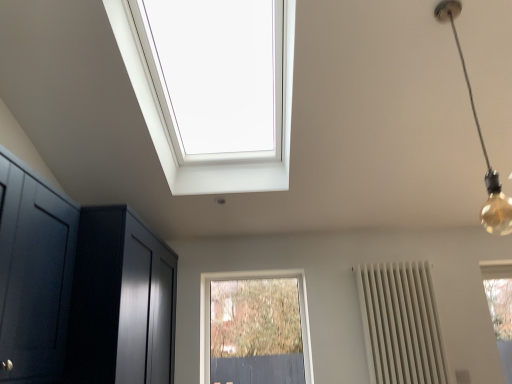
Question: Is glossy dark wood dresser at left beside gold bulb at upper right?

Choices:
 (A) yes
 (B) no

Answer: (B)

Question: Considering the relative sizes of glossy dark wood dresser at left and gold bulb at upper right in the image provided, is glossy dark wood dresser at left thinner than gold bulb at upper right?

Choices:
 (A) yes
 (B) no

Answer: (B)

Question: Can you confirm if glossy dark wood dresser at left is positioned to the right of gold bulb at upper right?

Choices:
 (A) no
 (B) yes

Answer: (A)

Question: Can you confirm if glossy dark wood dresser at left is positioned to the left of gold bulb at upper right?

Choices:
 (A) yes
 (B) no

Answer: (A)

Question: Is the position of glossy dark wood dresser at left more distant than that of gold bulb at upper right?

Choices:
 (A) no
 (B) yes

Answer: (B)

Question: Does glossy dark wood dresser at left have a greater height compared to gold bulb at upper right?

Choices:
 (A) no
 (B) yes

Answer: (A)

Question: From a real-world perspective, is gold bulb at upper right below white matte radiator at right?

Choices:
 (A) yes
 (B) no

Answer: (B)

Question: Is gold bulb at upper right positioned far away from white matte radiator at right?

Choices:
 (A) no
 (B) yes

Answer: (A)

Question: Would you say gold bulb at upper right is outside white matte radiator at right?

Choices:
 (A) no
 (B) yes

Answer: (B)

Question: From a real-world perspective, is gold bulb at upper right positioned over white matte radiator at right based on gravity?

Choices:
 (A) no
 (B) yes

Answer: (B)

Question: Does gold bulb at upper right have a lesser height compared to white matte radiator at right?

Choices:
 (A) no
 (B) yes

Answer: (A)

Question: Is gold bulb at upper right facing away from white matte radiator at right?

Choices:
 (A) yes
 (B) no

Answer: (A)

Question: Does white matte radiator at right have a lesser width compared to gold bulb at upper right?

Choices:
 (A) no
 (B) yes

Answer: (A)